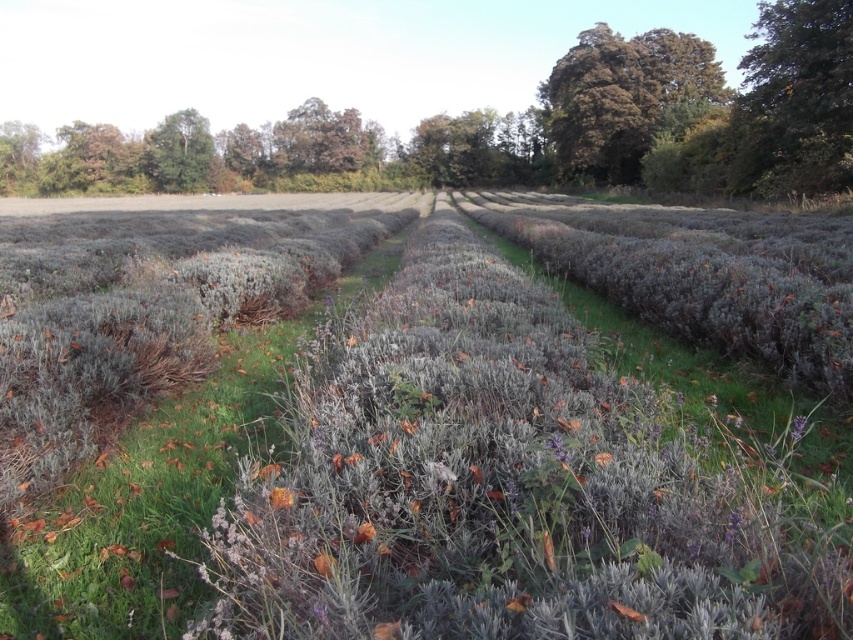
Question: Estimate the real-world distances between objects in this image. Which object is closer to the green leafy tree at upper left?

Choices:
 (A) green leafy tree at upper right
 (B) purple fuzzy flower at center
 (C) orange matte flower at center

Answer: (A)

Question: Which object appears closest to the camera in this image?

Choices:
 (A) orange matte flower at center
 (B) purple fuzzy flower at center
 (C) brown textured tree at upper right
 (D) gray fuzzy bush at center

Answer: (D)

Question: Is gray fuzzy bush at center bigger than brown textured tree at upper right?

Choices:
 (A) yes
 (B) no

Answer: (B)

Question: Can you confirm if green leafy tree at upper right is positioned to the right of brown textured tree at upper right?

Choices:
 (A) yes
 (B) no

Answer: (A)

Question: Observing the image, what is the correct spatial positioning of brown textured tree at upper right in reference to purple fuzzy flower at center?

Choices:
 (A) right
 (B) left

Answer: (A)

Question: Which of the following is the closest to the observer?

Choices:
 (A) (289, 492)
 (B) (367, 531)
 (C) (675, 76)
 (D) (329, 618)

Answer: (D)